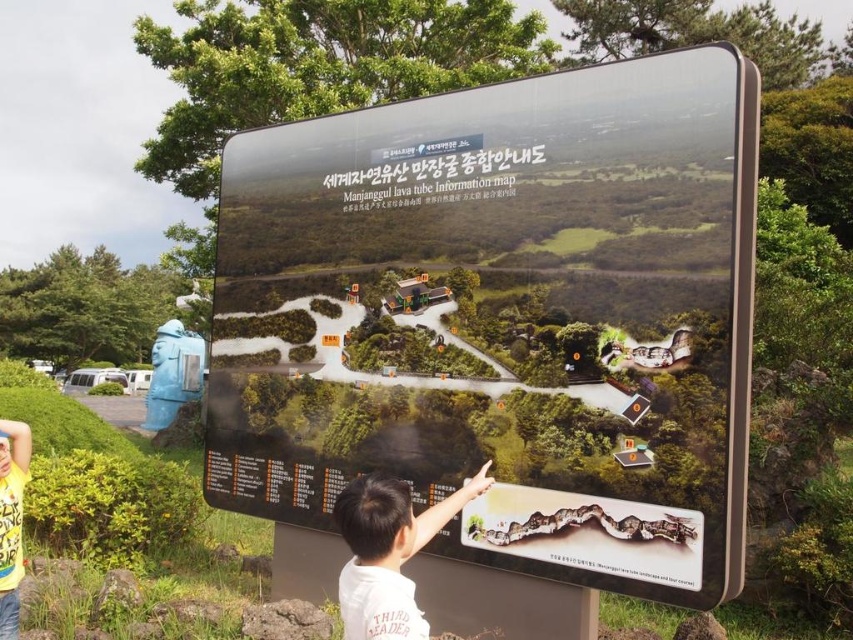
You are looking at the Manjanggul lava tube information map on the signboard. There are two points marked on the map at coordinates point (692, 378) and point (15, 497). Which of these points is closer to you as you stand in front of the signboard?

Point (692, 378) is closer to the viewer than point (15, 497).